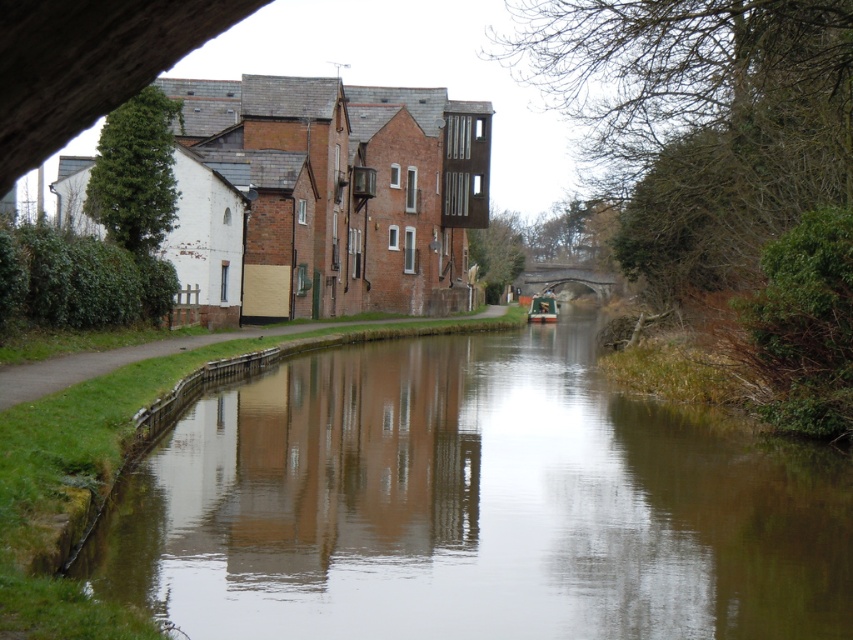
You are a tourist standing on the right bank of the canal. You see the smooth brown water at center and the green matte boat at center. Which object is located directly above the other?

The green matte boat at center is directly above the smooth brown water at center because the water is positioned under the boat.

You are a small boat operator planning to navigate through the canal. The boat requires a minimum width of 10 meters to pass safely. Based on the scene, can you determine if the smooth brown water at center is wide enough for your boat to pass under the stone arch bridge at center?

The smooth brown water at center might be wider than stone arch bridge at center, so there is a possibility that the boat can pass safely. However, without exact measurements, it is recommended to proceed with caution or seek further information.